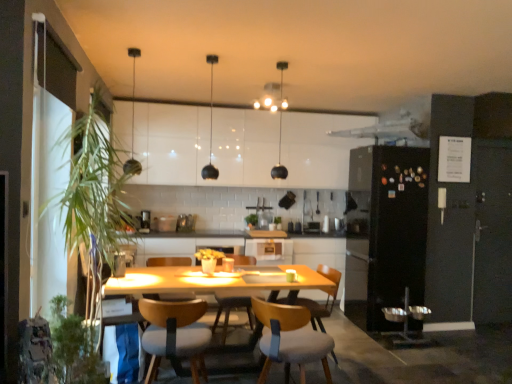
Question: Considering the positions of wooden chair with cushion at center, the second chair from the front, and white glossy cabinet at center, which ranks as the second cabinetry in top-to-bottom order, in the image, is wooden chair with cushion at center, the second chair from the front, bigger or smaller than white glossy cabinet at center, which ranks as the second cabinetry in top-to-bottom order,?

Choices:
 (A) small
 (B) big

Answer: (B)

Question: From a real-world perspective, is wooden chair with cushion at center, the second chair from the front, physically located above or below white glossy cabinet at center, which is counted as the 2th cabinetry, starting from the front?

Choices:
 (A) below
 (B) above

Answer: (A)

Question: Which object is the closest to the wooden chair with blue cushion at center, which is the 4th chair from back to front?

Choices:
 (A) metallic silver toaster at center, which is the 2th appliance from left to right
 (B) white glossy cabinets at upper center, the 2th cabinetry positioned from the back
 (C) white glossy cabinet at center, which is counted as the 2th cabinetry, starting from the left
 (D) wooden chair with cushion at center, which is counted as the second chair, starting from the back
 (E) green leafy plant at left, acting as the 1th plant starting from the left

Answer: (D)

Question: Estimate the real-world distances between objects in this image. Which object is farther from the matte black pendant light at upper center, placed as the third light fixture when sorted from right to left?

Choices:
 (A) wooden chair at center, acting as the first chair starting from the back
 (B) wooden chair with blue cushion at center, the first chair viewed from the front
 (C) matte black pendant light at center, which is the 3th light fixture in left-to-right order
 (D) white glossy cabinets at upper center, the 1th cabinetry in the left-to-right sequence
 (E) green leafy plant at center, the 1th plant when ordered from back to front

Answer: (A)